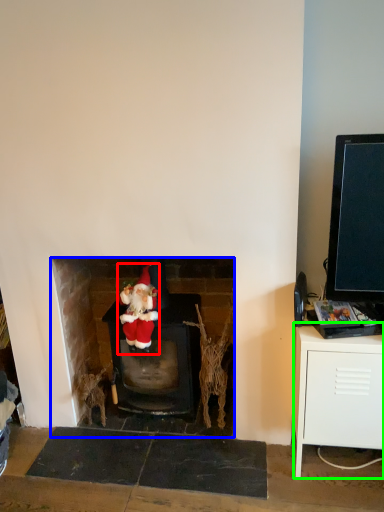
Question: Estimate the real-world distances between objects in this image. Which object is closer to person (highlighted by a red box), fireplace (highlighted by a blue box) or table (highlighted by a green box)?

Choices:
 (A) fireplace
 (B) table

Answer: (A)